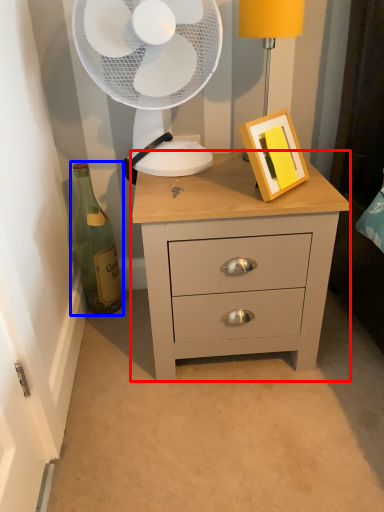
Question: Which object appears closest to the camera in this image, chest of drawers (highlighted by a red box) or bottle (highlighted by a blue box)?

Choices:
 (A) chest of drawers
 (B) bottle

Answer: (A)